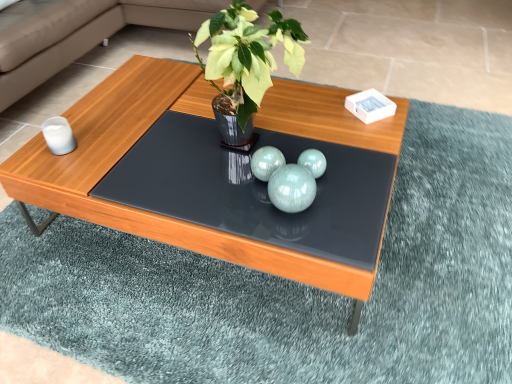
Identify the location of spots to the right of teal glossy spheres at center. (347, 199).